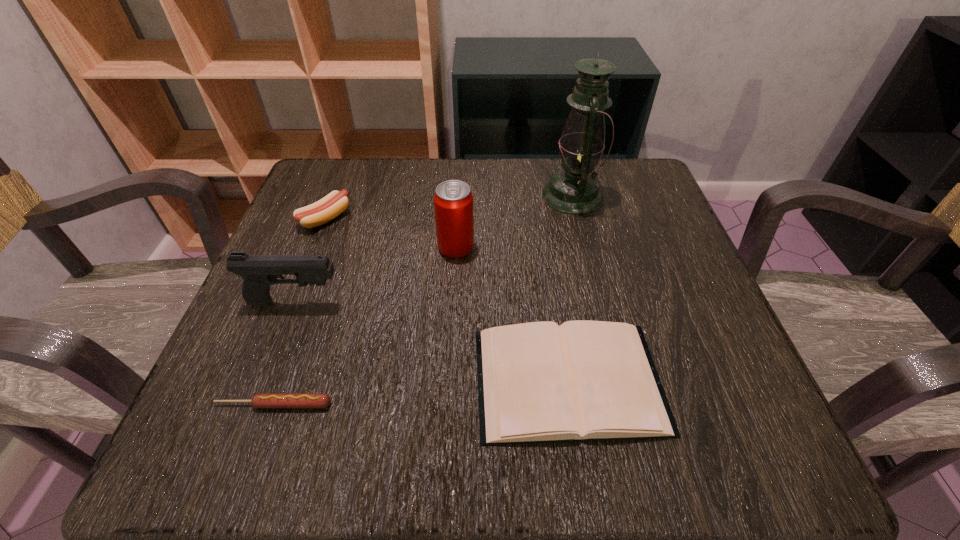
The height and width of the screenshot is (540, 960). In order to click on free spot between the pistol and the fifth tallest object in this screenshot , I will do `click(432, 341)`.

You are a GUI agent. You are given a task and a screenshot of the screen. Output one action in this format:
    pyautogui.click(x=<x>, y=<y>)
    Task: Click on the fourth closest object to the can
    The image size is (960, 540).
    Given the screenshot: What is the action you would take?
    pyautogui.click(x=332, y=205)

Locate an element on the screen. This screenshot has height=540, width=960. object that is the second closest one to the shortest object is located at coordinates (538, 382).

Identify the location of free space that satisfies the following two spatial constraints: 1. at the barrel of the hardback book; 2. on the left side of the third tallest object. The image size is (960, 540). (266, 380).

At what (x,y) coordinates should I click in order to perform the action: click on vacant region that satisfies the following two spatial constraints: 1. on the back side of the second shortest object; 2. on the left side of the tallest object. Please return your answer as a coordinate pair (x, y). The width and height of the screenshot is (960, 540). Looking at the image, I should click on (540, 195).

You are a GUI agent. You are given a task and a screenshot of the screen. Output one action in this format:
    pyautogui.click(x=<x>, y=<y>)
    Task: Click on the free spot that satisfies the following two spatial constraints: 1. on the back side of the shorter sausage; 2. on the right side of the can
    
    Given the screenshot: What is the action you would take?
    pyautogui.click(x=329, y=247)

Where is `vacant space that satisfies the following two spatial constraints: 1. on the back side of the shortest object; 2. on the left side of the second shortest object`? This screenshot has height=540, width=960. vacant space that satisfies the following two spatial constraints: 1. on the back side of the shortest object; 2. on the left side of the second shortest object is located at coordinates (282, 380).